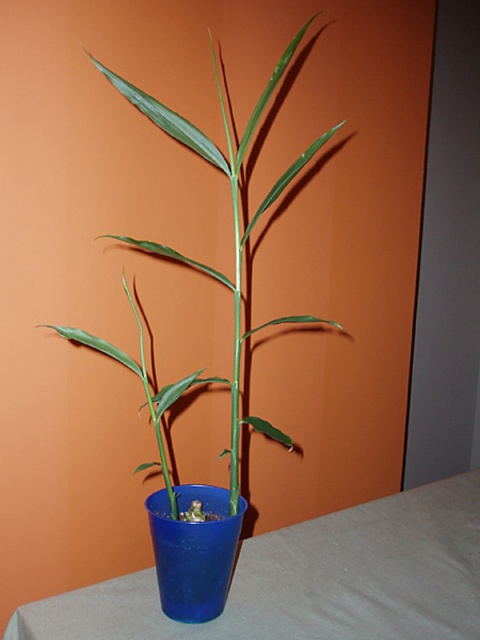
Can you confirm if blue plastic table at center is wider than green glossy plant at center?

Yes, blue plastic table at center is wider than green glossy plant at center.

This screenshot has height=640, width=480. What do you see at coordinates (311, 580) in the screenshot? I see `blue plastic table at center` at bounding box center [311, 580].

You are a GUI agent. You are given a task and a screenshot of the screen. Output one action in this format:
    pyautogui.click(x=<x>, y=<y>)
    Task: Click on the blue plastic table at center
    This screenshot has width=480, height=640.
    Given the screenshot: What is the action you would take?
    pyautogui.click(x=311, y=580)

Who is shorter, green glossy plant at center or blue plastic cup at center?

With less height is blue plastic cup at center.

At what (x,y) coordinates should I click in order to perform the action: click on green glossy plant at center. Please return your answer as a coordinate pair (x, y). Image resolution: width=480 pixels, height=640 pixels. Looking at the image, I should click on (204, 264).

Does point (266, 90) come closer to viewer compared to point (199, 557)?

That is True.

At what (x,y) coordinates should I click in order to perform the action: click on green glossy plant at center. Please return your answer as a coordinate pair (x, y). The image size is (480, 640). Looking at the image, I should click on (204, 264).

Is blue plastic table at center positioned behind blue plastic cup at center?

No, blue plastic table at center is in front of blue plastic cup at center.

Who is shorter, blue plastic table at center or blue plastic cup at center?

blue plastic table at center is shorter.

Between point (300, 637) and point (201, 621), which one is positioned behind?

The point (201, 621) is behind.

Find the location of a particular element. blue plastic table at center is located at coordinates (311, 580).